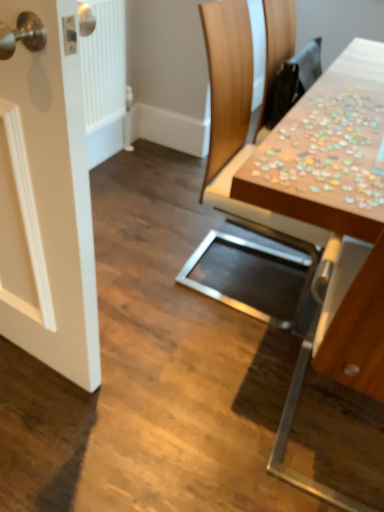
Find the location of a particular element. This screenshot has width=384, height=512. vacant space underneath wooden chair at upper right (from a real-world perspective) is located at coordinates (228, 268).